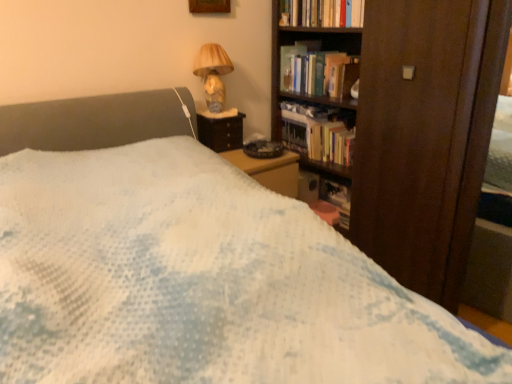
Identify the location of empty space that is ontop of wooden nightstand at upper right (from a real-world perspective). Image resolution: width=512 pixels, height=384 pixels. (218, 113).